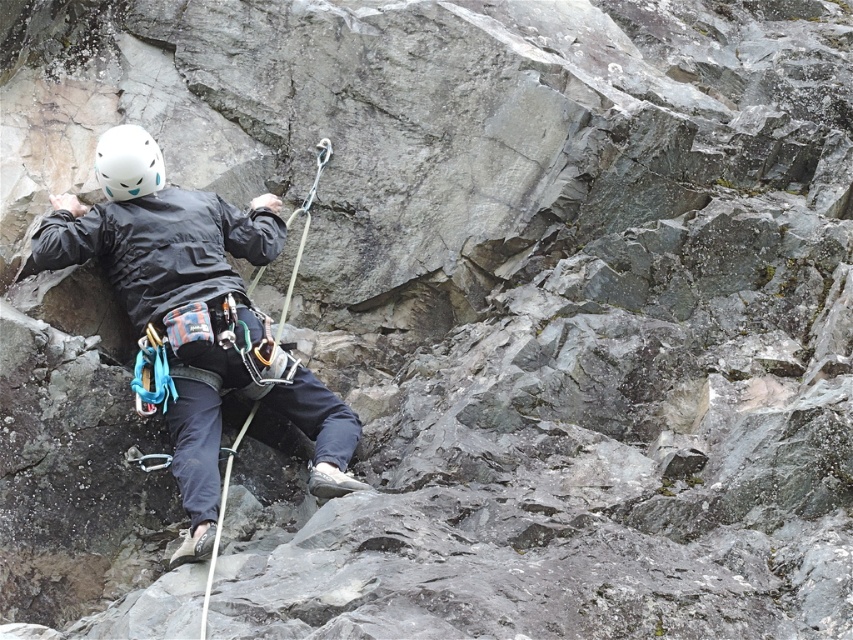
Can you confirm if matte black jacket at center is bigger than white matte helmet at upper left?

No, matte black jacket at center is not bigger than white matte helmet at upper left.

Between matte black jacket at center and white matte helmet at upper left, which one appears on the left side from the viewer's perspective?

From the viewer's perspective, matte black jacket at center appears more on the left side.

Which is behind, point (99, 205) or point (113, 128)?

The point (113, 128) is behind.

Image resolution: width=853 pixels, height=640 pixels. I want to click on matte black jacket at center, so click(x=202, y=328).